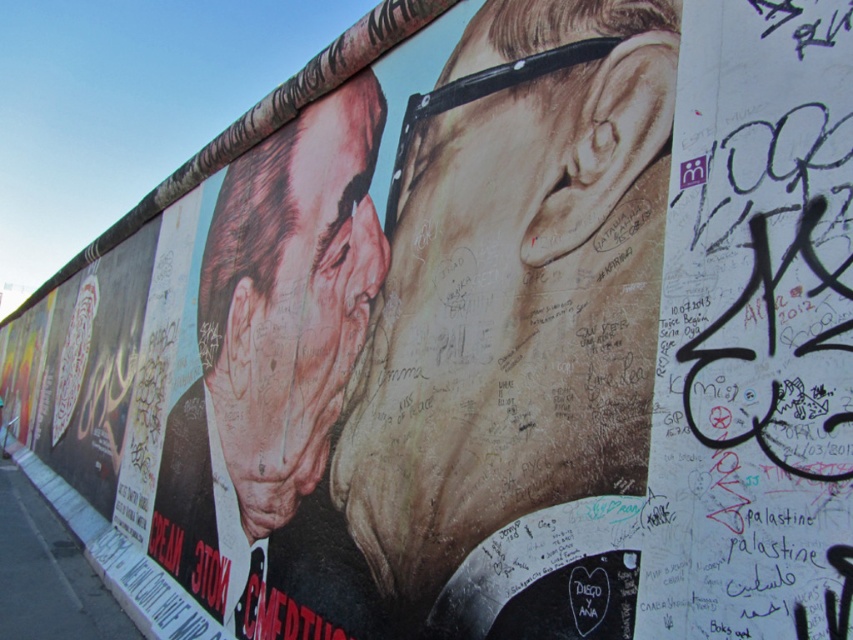
You are an art student analyzing the Berlin Wall mural. You notice the matte brown face at center and the black graffiti at right. Which object is positioned lower on the wall?

The matte brown face at center is positioned lower on the wall than the black graffiti at right.

You are an artist planning to add a new sticker to the Berlin Wall scene. Your sticker is 0.1 meters wide and you want to place it near the black graffiti at right. Where should you place your sticker to ensure it doesn

The black graffiti at right is located at point (x=753, y=332). To place your sticker near it, position it close to those coordinates, ensuring it is within a reasonable distance to maintain visual harmony while avoiding overlap.

You are standing in front of the Berlin Wall and see two points marked on the wall. The first point is at coordinates point (718,44) and the second is at point (196,417). Which point is closer to you?

Point (718,44) is in front of point (196,417), so the first point is closer to you.